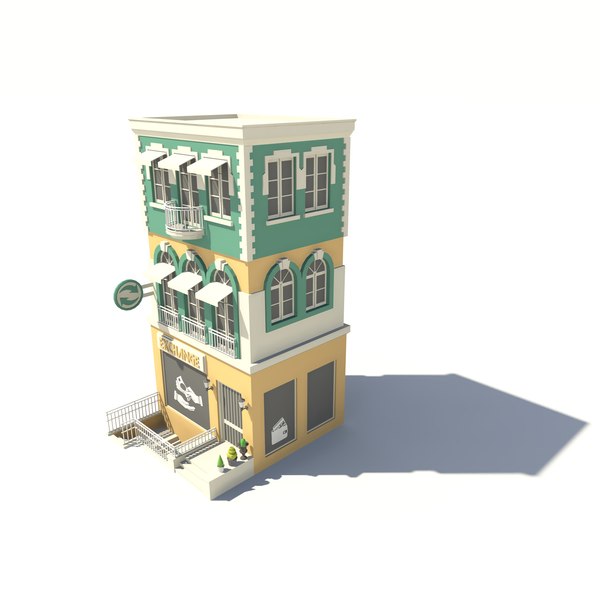
The image size is (600, 600). In order to click on bottom floor side windows in this screenshot , I will do `click(281, 410)`, `click(320, 400)`.